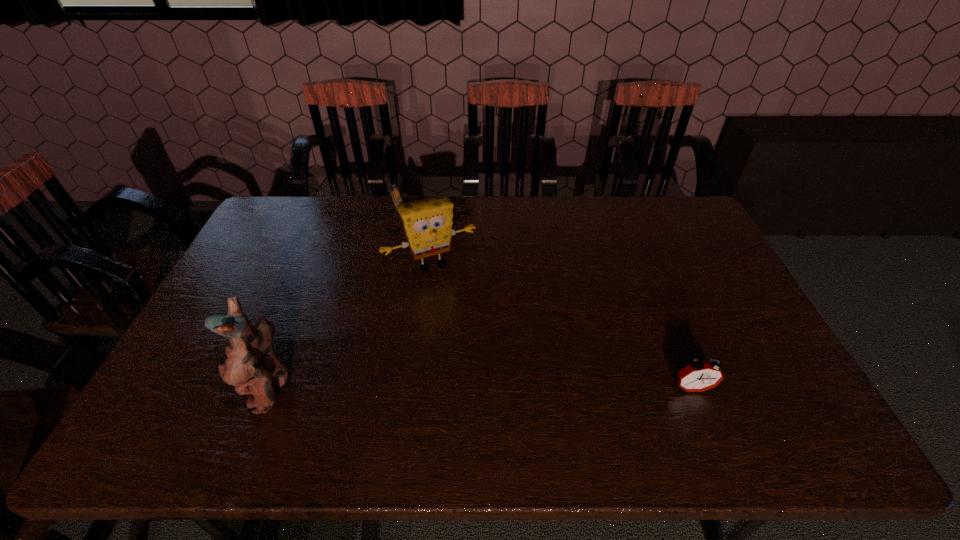
You are a GUI agent. You are given a task and a screenshot of the screen. Output one action in this format:
    pyautogui.click(x=<x>, y=<y>)
    Task: Click on the vacant space on the desktop that is between the leftmost object and the second shortest object and is positioned on the face of the sponge
    This screenshot has width=960, height=540.
    Given the screenshot: What is the action you would take?
    pyautogui.click(x=494, y=388)

This screenshot has width=960, height=540. I want to click on free space on the desktop that is between the leftmost object and the second shortest object and is positioned at the stem of the shortest object, so click(x=466, y=388).